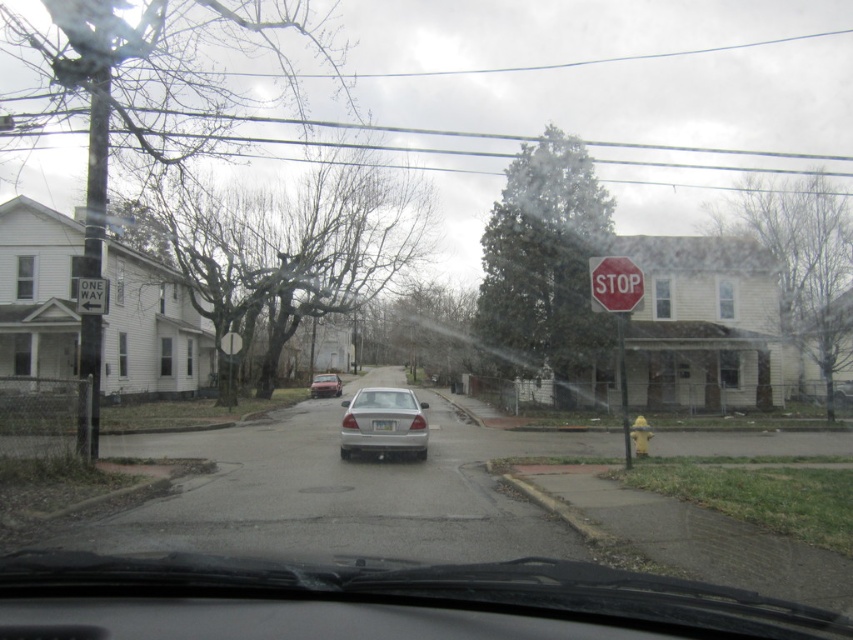
Does red matte stop sign at upper right have a lesser width compared to matte silver sedan at center?

Correct, red matte stop sign at upper right's width is less than matte silver sedan at center's.

Does red matte stop sign at upper right appear under matte silver sedan at center?

No, red matte stop sign at upper right is not below matte silver sedan at center.

The image size is (853, 640). What are the coordinates of `red matte stop sign at upper right` in the screenshot? It's located at (614, 284).

Can you confirm if clear glass windshield at center is positioned above white plastic one way sign at upper left?

No, clear glass windshield at center is not above white plastic one way sign at upper left.

Which is more to the left, clear glass windshield at center or white plastic one way sign at upper left?

Positioned to the left is white plastic one way sign at upper left.

You are a GUI agent. You are given a task and a screenshot of the screen. Output one action in this format:
    pyautogui.click(x=<x>, y=<y>)
    Task: Click on the clear glass windshield at center
    
    Given the screenshot: What is the action you would take?
    pyautogui.click(x=384, y=400)

Which of these two, silver metallic sedan at center or red matte stop sign at upper right, stands shorter?

red matte stop sign at upper right is shorter.

Is point (379, 422) in front of point (631, 282)?

No, (379, 422) is further to viewer.

Who is more forward, (389, 417) or (612, 310)?

Point (612, 310)

Identify the location of silver metallic sedan at center. (383, 422).